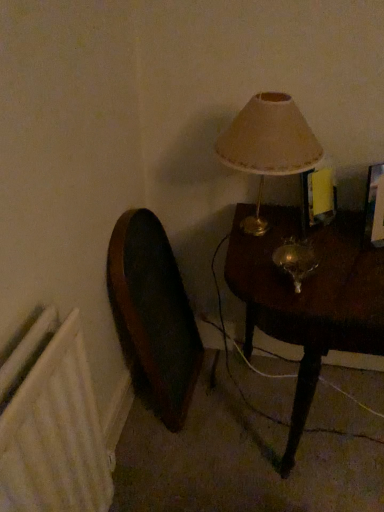
Identify the location of mahogany wood table at right. The image size is (384, 512). (309, 298).

Find the location of a particular element. white textured radiator at lower left is located at coordinates (52, 426).

What is the approximate height of matte beige lampshade at upper right?

15.72 inches.

Locate an element on the screen. This screenshot has width=384, height=512. wooden swivel chair at left is located at coordinates (153, 315).

You are a GUI agent. You are given a task and a screenshot of the screen. Output one action in this format:
    pyautogui.click(x=<x>, y=<y>)
    Task: Click on the mahogany wood table at right
    Image resolution: width=384 pixels, height=512 pixels.
    Given the screenshot: What is the action you would take?
    pyautogui.click(x=309, y=298)

Considering the sizes of objects white textured radiator at lower left and matte beige lampshade at upper right in the image provided, who is taller, white textured radiator at lower left or matte beige lampshade at upper right?

With more height is white textured radiator at lower left.

Who is bigger, white textured radiator at lower left or matte beige lampshade at upper right?

matte beige lampshade at upper right is bigger.

From a real-world perspective, is white textured radiator at lower left on top of matte beige lampshade at upper right?

No.

Is white textured radiator at lower left turned away from matte beige lampshade at upper right?

white textured radiator at lower left is not turned away from matte beige lampshade at upper right.

Is mahogany wood table at right shorter than white textured radiator at lower left?

Indeed, mahogany wood table at right has a lesser height compared to white textured radiator at lower left.

Is mahogany wood table at right oriented towards white textured radiator at lower left?

No, mahogany wood table at right is not facing towards white textured radiator at lower left.

Would you say mahogany wood table at right is a long distance from white textured radiator at lower left?

mahogany wood table at right is near white textured radiator at lower left, not far away.

Can you confirm if mahogany wood table at right is thinner than white textured radiator at lower left?

No.

Is mahogany wood table at right not near matte beige lampshade at upper right?

mahogany wood table at right is near matte beige lampshade at upper right, not far away.

From the image's perspective, is mahogany wood table at right positioned above or below matte beige lampshade at upper right?

mahogany wood table at right is below matte beige lampshade at upper right.

Consider the image. Which of these two, mahogany wood table at right or matte beige lampshade at upper right, is thinner?

matte beige lampshade at upper right is thinner.

Considering the sizes of objects mahogany wood table at right and matte beige lampshade at upper right in the image provided, who is bigger, mahogany wood table at right or matte beige lampshade at upper right?

mahogany wood table at right is bigger.

Consider the image. Is matte beige lampshade at upper right positioned beyond the bounds of mahogany wood table at right?

Yes, matte beige lampshade at upper right is outside of mahogany wood table at right.

Is matte beige lampshade at upper right aimed at mahogany wood table at right?

No, matte beige lampshade at upper right is not aimed at mahogany wood table at right.

Consider the image. Is matte beige lampshade at upper right taller than mahogany wood table at right?

No, matte beige lampshade at upper right is not taller than mahogany wood table at right.

Does point (224, 136) lie in front of point (316, 304)?

No, it is not.

Between white textured radiator at lower left and mahogany wood table at right, which one has more height?

white textured radiator at lower left.

From a real-world perspective, does white textured radiator at lower left stand above mahogany wood table at right?

Yes.

Is mahogany wood table at right at the back of white textured radiator at lower left?

No, white textured radiator at lower left is not facing away from mahogany wood table at right.

Considering the relative sizes of wooden swivel chair at left and white textured radiator at lower left in the image provided, is wooden swivel chair at left wider than white textured radiator at lower left?

Indeed, wooden swivel chair at left has a greater width compared to white textured radiator at lower left.

Is wooden swivel chair at left completely or partially outside of white textured radiator at lower left?

wooden swivel chair at left is positioned outside white textured radiator at lower left.

Is wooden swivel chair at left positioned behind white textured radiator at lower left?

Yes, wooden swivel chair at left is further from the viewer.

Could you tell me if wooden swivel chair at left is turned towards white textured radiator at lower left?

No, wooden swivel chair at left is not oriented towards white textured radiator at lower left.

You are a GUI agent. You are given a task and a screenshot of the screen. Output one action in this format:
    pyautogui.click(x=<x>, y=<y>)
    Task: Click on the lamp that appears above the white textured radiator at lower left (from the image's perspective)
    Image resolution: width=384 pixels, height=512 pixels.
    Given the screenshot: What is the action you would take?
    tap(270, 149)

Is matte beige lampshade at upper right not inside white textured radiator at lower left?

Yes, matte beige lampshade at upper right is outside of white textured radiator at lower left.

In terms of height, does matte beige lampshade at upper right look taller or shorter compared to white textured radiator at lower left?

In the image, matte beige lampshade at upper right appears to be shorter than white textured radiator at lower left.

From a real-world perspective, is matte beige lampshade at upper right positioned under white textured radiator at lower left based on gravity?

No, from a real-world perspective, matte beige lampshade at upper right is not below white textured radiator at lower left.

In order to click on lamp that is behind the white textured radiator at lower left in this screenshot , I will do `click(270, 149)`.

The width and height of the screenshot is (384, 512). Find the location of `table on the right of white textured radiator at lower left`. table on the right of white textured radiator at lower left is located at coordinates (309, 298).

When comparing their distances from mahogany wood table at right, does wooden swivel chair at left or matte beige lampshade at upper right seem closer?

The object closer to mahogany wood table at right is matte beige lampshade at upper right.

Based on their spatial positions, is matte beige lampshade at upper right or mahogany wood table at right closer to wooden swivel chair at left?

Among the two, mahogany wood table at right is located nearer to wooden swivel chair at left.

When comparing their distances from mahogany wood table at right, does matte beige lampshade at upper right or white textured radiator at lower left seem closer?

The object closer to mahogany wood table at right is matte beige lampshade at upper right.

When comparing their distances from white textured radiator at lower left, does mahogany wood table at right or matte beige lampshade at upper right seem further?

The object further to white textured radiator at lower left is matte beige lampshade at upper right.

Estimate the real-world distances between objects in this image. Which object is closer to wooden swivel chair at left, white textured radiator at lower left or mahogany wood table at right?

mahogany wood table at right.

Estimate the real-world distances between objects in this image. Which object is closer to wooden swivel chair at left, mahogany wood table at right or matte beige lampshade at upper right?

Based on the image, mahogany wood table at right appears to be nearer to wooden swivel chair at left.

Looking at the image, which one is located closer to mahogany wood table at right, white textured radiator at lower left or matte beige lampshade at upper right?

Based on the image, matte beige lampshade at upper right appears to be nearer to mahogany wood table at right.

Considering their positions, is wooden swivel chair at left positioned closer to matte beige lampshade at upper right than white textured radiator at lower left?

wooden swivel chair at left.

Identify the location of swivel chair located between white textured radiator at lower left and mahogany wood table at right in the left-right direction. (153, 315).

Identify the location of swivel chair between matte beige lampshade at upper right and white textured radiator at lower left vertically. This screenshot has width=384, height=512. (153, 315).

This screenshot has width=384, height=512. What are the coordinates of `table between matte beige lampshade at upper right and white textured radiator at lower left in the vertical direction` in the screenshot? It's located at (309, 298).

Where is `swivel chair between matte beige lampshade at upper right and mahogany wood table at right vertically`? swivel chair between matte beige lampshade at upper right and mahogany wood table at right vertically is located at coordinates (153, 315).